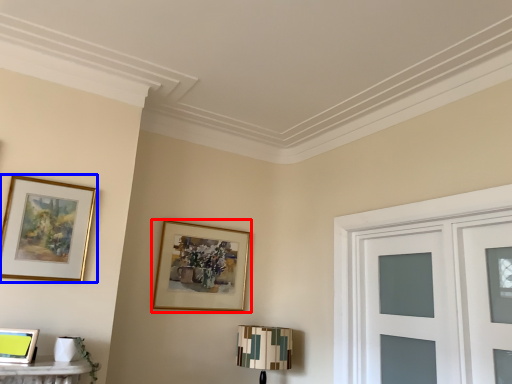
Question: Which object is further to the camera taking this photo, picture frame (highlighted by a red box) or picture frame (highlighted by a blue box)?

Choices:
 (A) picture frame
 (B) picture frame

Answer: (A)